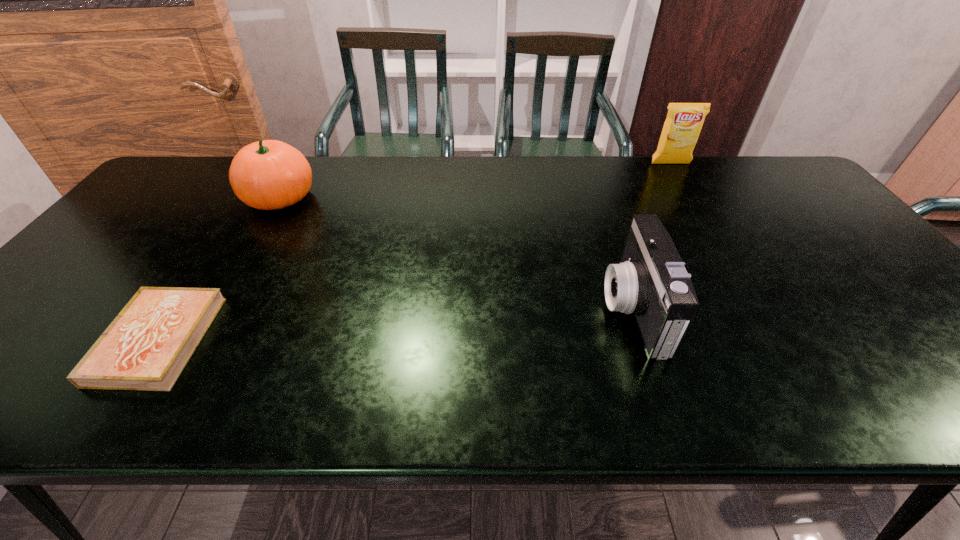
Image resolution: width=960 pixels, height=540 pixels. I want to click on unoccupied position between the shortest object and the third object from left to right, so click(x=396, y=325).

Where is `free space between the crisp (potato chip) and the shortest object`? This screenshot has width=960, height=540. free space between the crisp (potato chip) and the shortest object is located at coordinates (415, 252).

You are a GUI agent. You are given a task and a screenshot of the screen. Output one action in this format:
    pyautogui.click(x=<x>, y=<y>)
    Task: Click on the vacant area that lies between the rightmost object and the shortest object
    
    Given the screenshot: What is the action you would take?
    pyautogui.click(x=415, y=252)

Locate an element on the screen. The width and height of the screenshot is (960, 540). free space between the farthest object and the pumpkin is located at coordinates (475, 180).

You are a GUI agent. You are given a task and a screenshot of the screen. Output one action in this format:
    pyautogui.click(x=<x>, y=<y>)
    Task: Click on the free space between the farthest object and the third nearest object
    The image size is (960, 540).
    Given the screenshot: What is the action you would take?
    pyautogui.click(x=475, y=180)

Locate an element on the screen. Image resolution: width=960 pixels, height=540 pixels. vacant area that lies between the hardback book and the second farthest object is located at coordinates (219, 269).

At what (x,y) coordinates should I click in order to perform the action: click on empty location between the pumpkin and the camcorder. Please return your answer as a coordinate pair (x, y). Looking at the image, I should click on (456, 253).

Identify the location of free point between the crisp (potato chip) and the shortest object. (415, 252).

In order to click on the closest object to the farthest object in this screenshot , I will do `click(651, 281)`.

You are a GUI agent. You are given a task and a screenshot of the screen. Output one action in this format:
    pyautogui.click(x=<x>, y=<y>)
    Task: Click on the object that ranks as the third closest to the hardback book
    This screenshot has width=960, height=540.
    Given the screenshot: What is the action you would take?
    pyautogui.click(x=684, y=121)